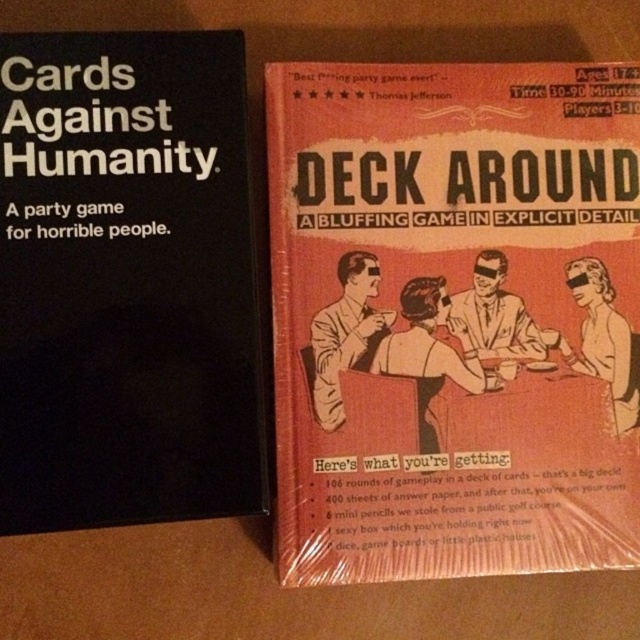
Who is taller, matte cardboard book at center or black matte box at left?

matte cardboard book at center

Does matte cardboard book at center have a lesser height compared to black matte box at left?

No, matte cardboard book at center is not shorter than black matte box at left.

Measure the distance between matte cardboard book at center and camera.

matte cardboard book at center is 25.35 inches from camera.

Where is `matte cardboard book at center`? This screenshot has height=640, width=640. matte cardboard book at center is located at coordinates (454, 317).